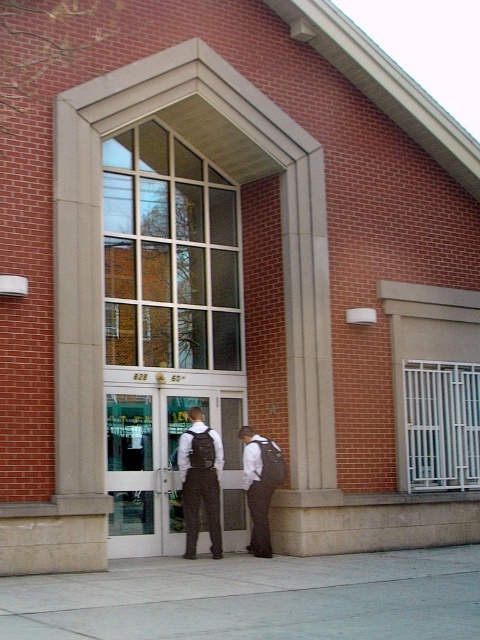
Question: Is dark gray backpack at center to the right of dark brown fabric vest at center from the viewer's perspective?

Choices:
 (A) no
 (B) yes

Answer: (A)

Question: In this image, where is gray concrete pavement at lower center located relative to dark brown fabric vest at center?

Choices:
 (A) above
 (B) below

Answer: (B)

Question: Which point is closer to the camera?

Choices:
 (A) (203, 456)
 (B) (273, 451)
 (C) (195, 432)
 (D) (439, 554)

Answer: (A)

Question: Which object appears farthest from the camera in this image?

Choices:
 (A) dark brown fabric vest at center
 (B) gray concrete pavement at lower center
 (C) dark gray fabric vest at center

Answer: (A)

Question: Is gray concrete pavement at lower center bigger than dark gray overalls at center?

Choices:
 (A) no
 (B) yes

Answer: (A)

Question: Among these objects, which one is nearest to the camera?

Choices:
 (A) dark brown fabric vest at center
 (B) dark gray overalls at center
 (C) gray concrete pavement at lower center
 (D) dark gray fabric vest at center

Answer: (C)